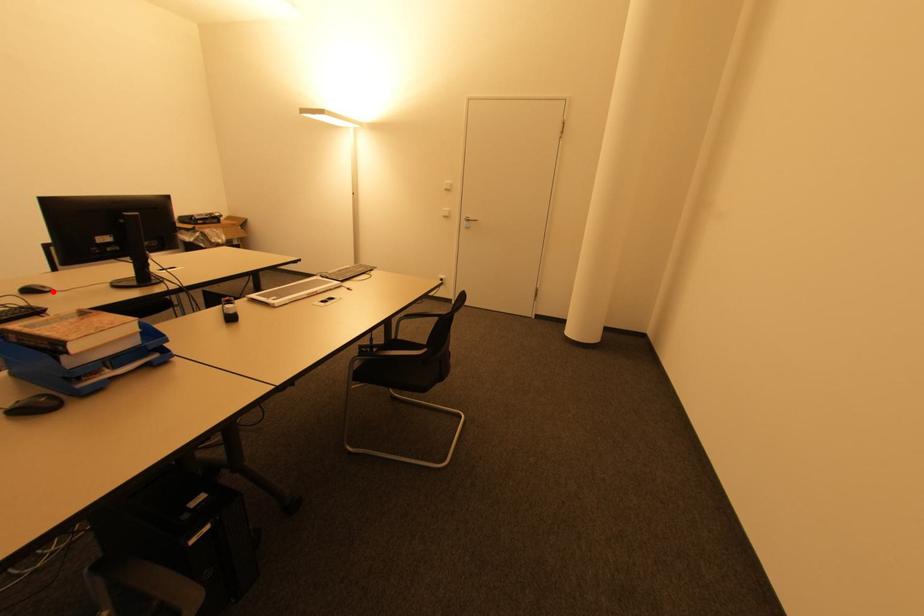
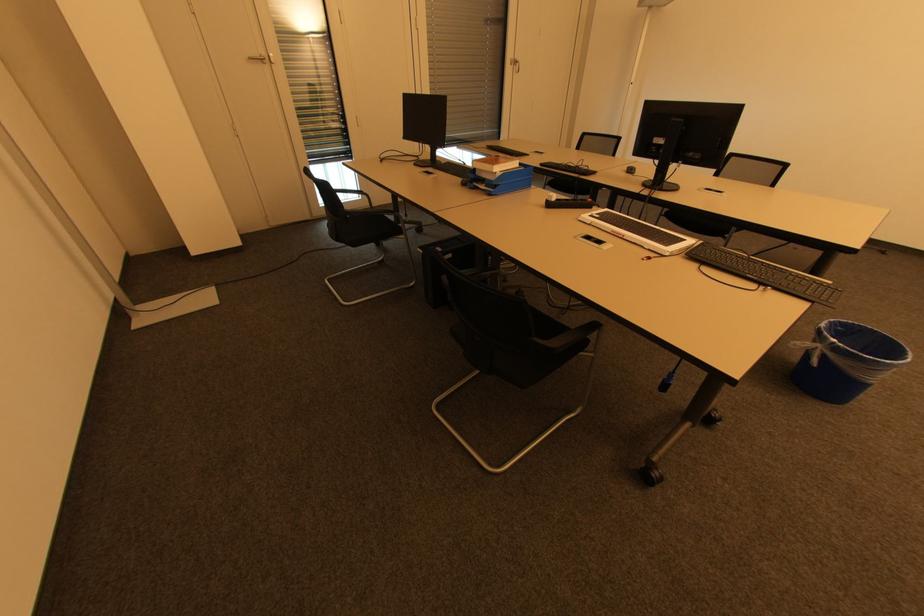
Where in the second image is the point corresponding to the highlighted location from the first image?

(634, 174)